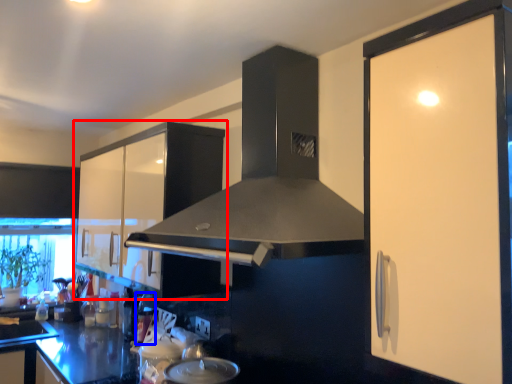
Question: Among these objects, which one is farthest to the camera, cabinetry (highlighted by a red box) or appliance (highlighted by a blue box)?

Choices:
 (A) cabinetry
 (B) appliance

Answer: (B)